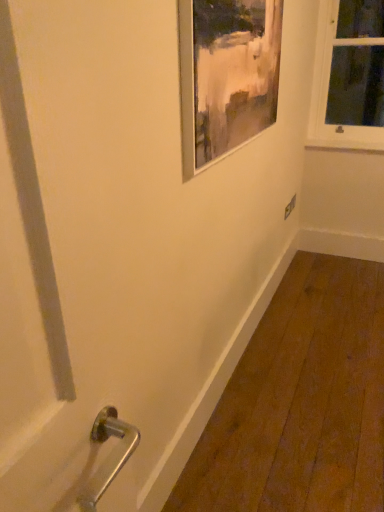
Question: In terms of width, does white matte window sill at upper right look wider or thinner when compared to white wooden window at upper right?

Choices:
 (A) wide
 (B) thin

Answer: (B)

Question: In the image, is white matte window sill at upper right on the left side or the right side of white wooden window at upper right?

Choices:
 (A) left
 (B) right

Answer: (A)

Question: Estimate the real-world distances between objects in this image. Which object is closer to the metallic silver picture frame at upper center?

Choices:
 (A) white matte window sill at upper right
 (B) white wooden window at upper right

Answer: (B)

Question: Considering the real-world distances, which object is closest to the white wooden window at upper right?

Choices:
 (A) metallic silver picture frame at upper center
 (B) white matte window sill at upper right

Answer: (B)